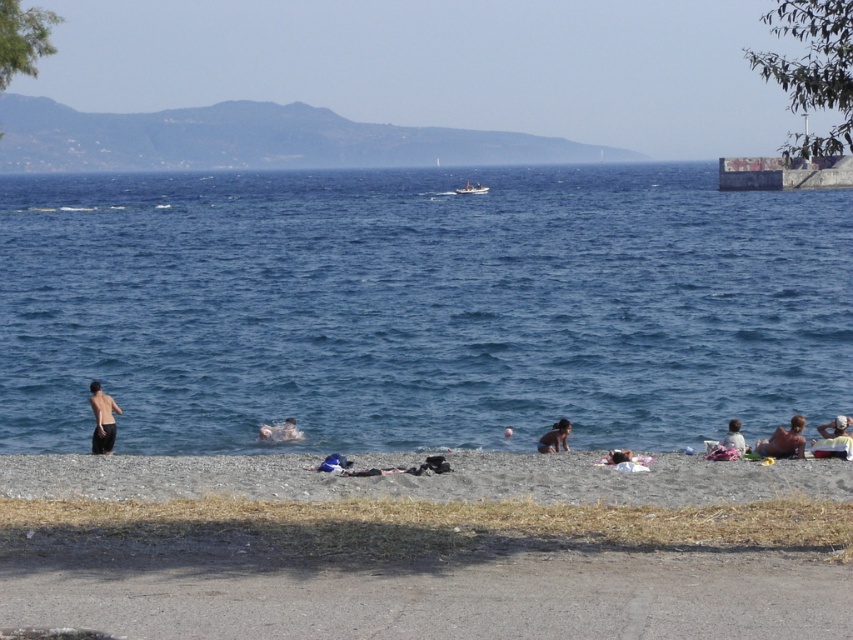
You are a lifeguard on duty and need to locate the smooth skin torso at lower left. Based on the coordinates provided, where would you find it in the image?

The smooth skin torso at lower left is located at coordinates point (102, 419) in the image.

You are a lifeguard on duty at the beach and need to reach both the smooth skin torso at lower left and the smooth tan skin at lower right. Given that your average walking speed is 1.5 meters per second, which individual will you reach first if you start from the center of the beach?

Both the smooth skin torso at lower left and smooth tan skin at lower right are 8.48 meters away from the center of the beach. Since they are equidistant, you will reach both at the same time if you move towards them simultaneously. However, if you choose to go to one first, the time taken will be the same for both, approximately 5.65 seconds.

You are a photographer standing on the beach. You want to take a photo of the smooth skin torso at lower left and the smooth tan skin at lower right without any obstruction. Which subject should you adjust your position to focus on first, considering their spatial arrangement?

The smooth tan skin at lower right is behind the smooth skin torso at lower left, so you should adjust your position to focus on the smooth skin torso at lower left first to avoid obstruction.